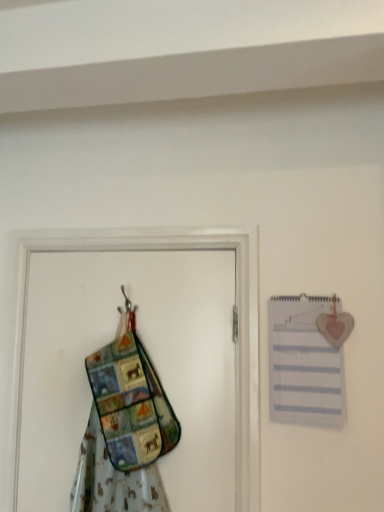
Question: Is multicolored fabric apron at left to the left or to the right of multicolored fabric screen door at left in the image?

Choices:
 (A) left
 (B) right

Answer: (B)

Question: Considering the positions of multicolored fabric apron at left and multicolored fabric screen door at left in the image, is multicolored fabric apron at left wider or thinner than multicolored fabric screen door at left?

Choices:
 (A) thin
 (B) wide

Answer: (B)

Question: Based on their relative distances, which object is farther from the white paper journal at upper right?

Choices:
 (A) multicolored fabric screen door at left
 (B) multicolored fabric apron at left

Answer: (B)

Question: Considering the real-world distances, which object is closest to the white paper journal at upper right?

Choices:
 (A) multicolored fabric screen door at left
 (B) multicolored fabric apron at left

Answer: (A)